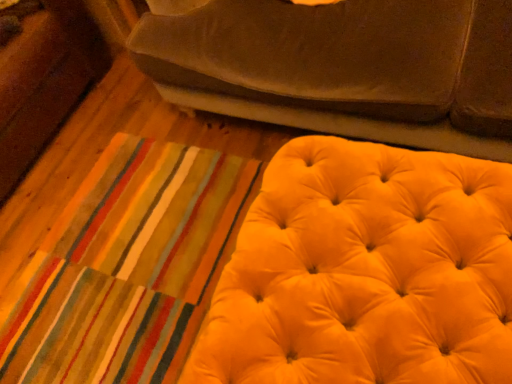
This screenshot has width=512, height=384. Find the location of `free space above yellow velvet ottoman at lower right (from a real-world perspective)`. free space above yellow velvet ottoman at lower right (from a real-world perspective) is located at coordinates (352, 284).